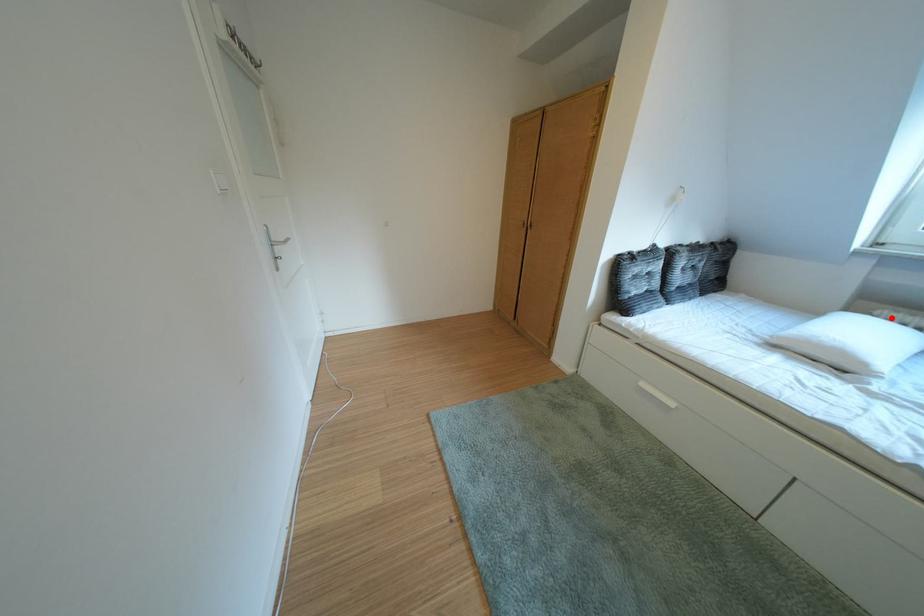
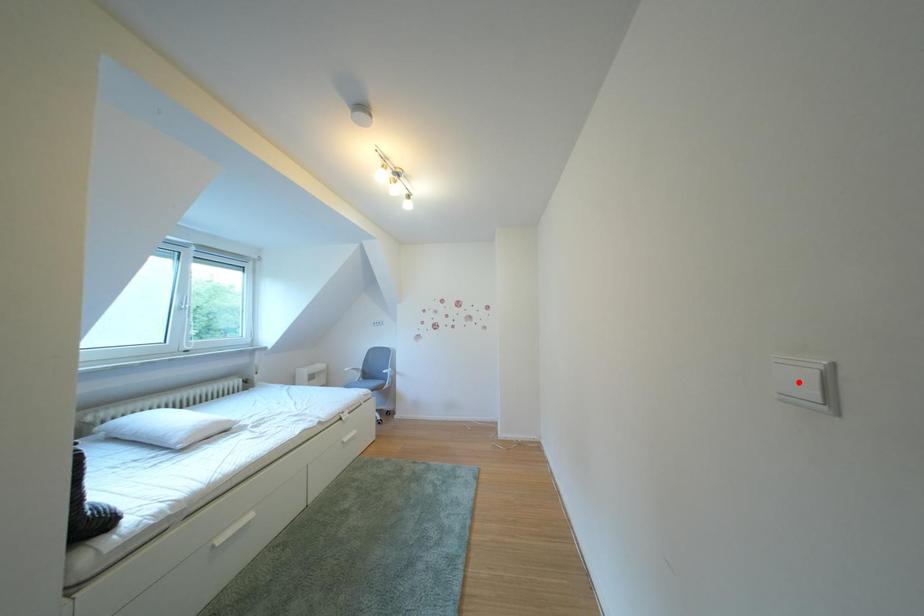
I am providing you with two images of the same scene from different viewpoints. A red point is marked on the first image and another point is marked on the second image. Do the highlighted points in image1 and image2 indicate the same real-world spot?

No